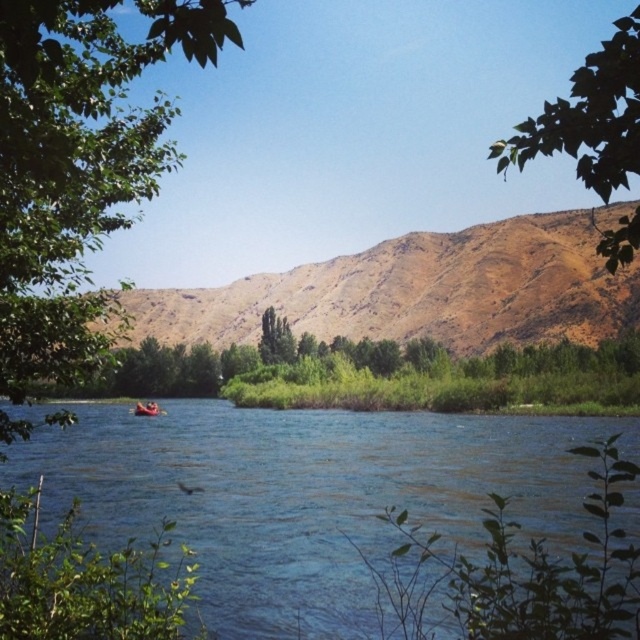
You are standing at the edge of the water and see the point marked at coordinates (371, 369). Based on the scene, what object is this point located on?

The point is located on the green leafy tree at center.